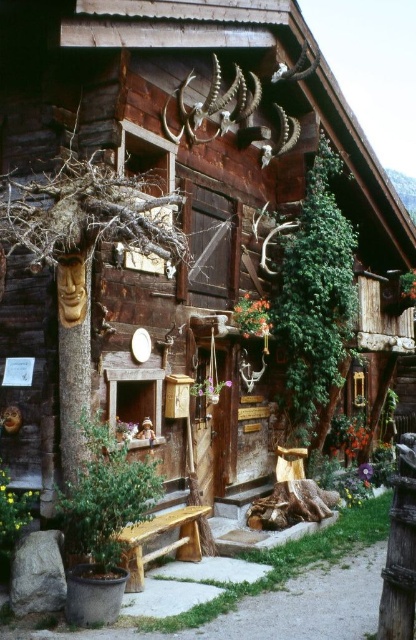
Where is the brown wood tree trunk at left located in the image?

The brown wood tree trunk at left is located at point (81,259) in the image.

You are standing in front of the rustic wooden building and want to touch both the antlers and the wooden plaque. The antlers are located at point (163, 221) and the plaque is at point (304, 344). Which point should you reach for first to touch the closer object?

You should reach for point (163, 221) first because it is closer to you than point (304, 344).

You are standing in front of the rustic wooden building and want to place a small decorative item between the green leafy plant at right and the natural wood bench at center. Where should you position it?

The green leafy plant at right is to the right of the natural wood bench at center, so you should place the decorative item between them by positioning it to the left of the green leafy plant at right and to the right of the natural wood bench at center.